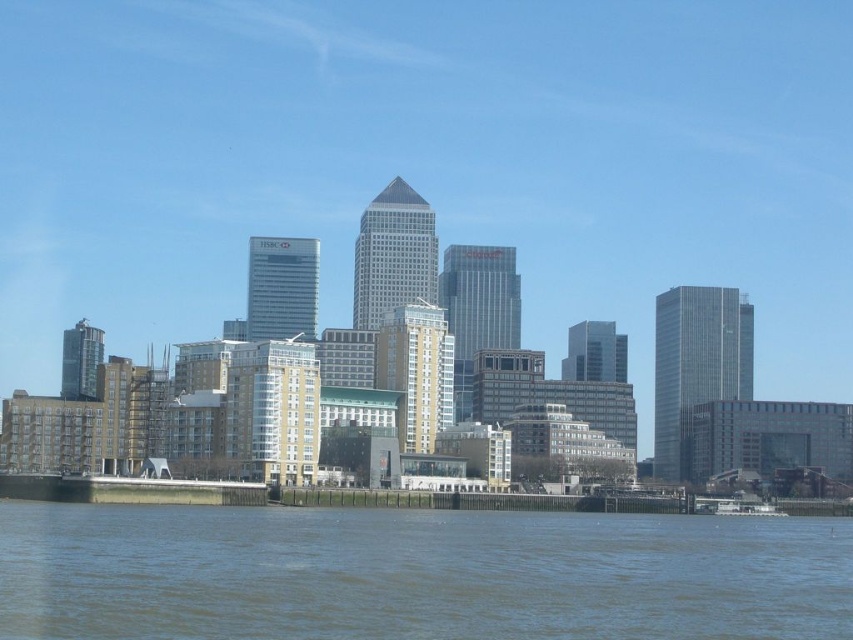
You are a drone operator trying to capture a photo of the city skyline. Your drone is currently hovering at the coordinates given by the brown water at lower center. To frame the pyramid shaped building in the center of the photo, should you move your drone upwards or downwards?

The brown water at lower center is located at point (416, 573). Since the pyramid shaped building is centrally situated in the skyline, moving the drone upwards would bring it into the center of the photo.